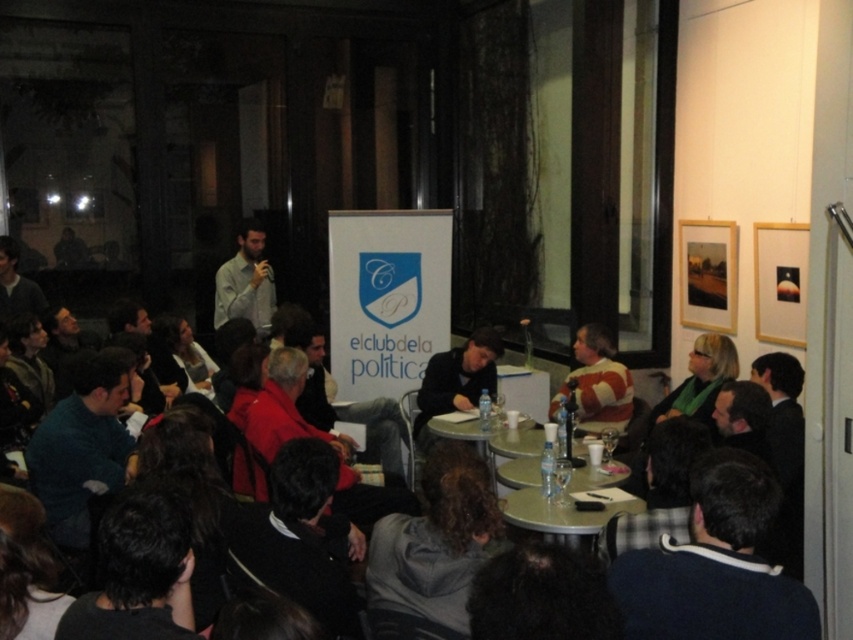
You are organizing a presentation and need to place a name tag on the table where the matte black laptop at center and the matte gray shirt at center are located. Which object should you place the name tag closer to if you want it to be more visible to the speaker?

The matte gray shirt at center is larger than the matte black laptop at center, so placing the name tag closer to the matte gray shirt at center would make it more visible to the speaker.

You are organizing a presentation and need to ensure that the matte black laptop at center is visible to everyone in the audience. Given that the matte gray shirt at center is blocking part of the laptop, can you determine if the laptop is still partially visible above the shirt?

The matte black laptop at center has a lesser height compared to the matte gray shirt at center, so it is likely that the laptop is partially blocked by the shirt, making only the lower part visible.